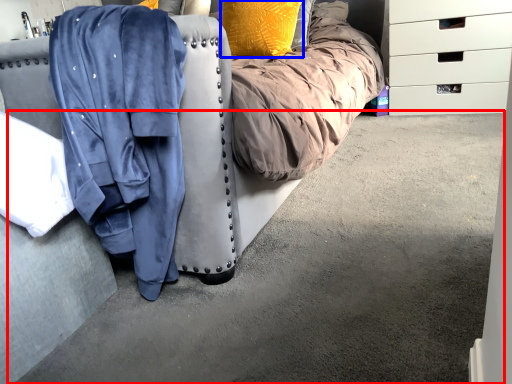
Question: Which object is further to the camera taking this photo, concrete (highlighted by a red box) or pillow (highlighted by a blue box)?

Choices:
 (A) concrete
 (B) pillow

Answer: (B)